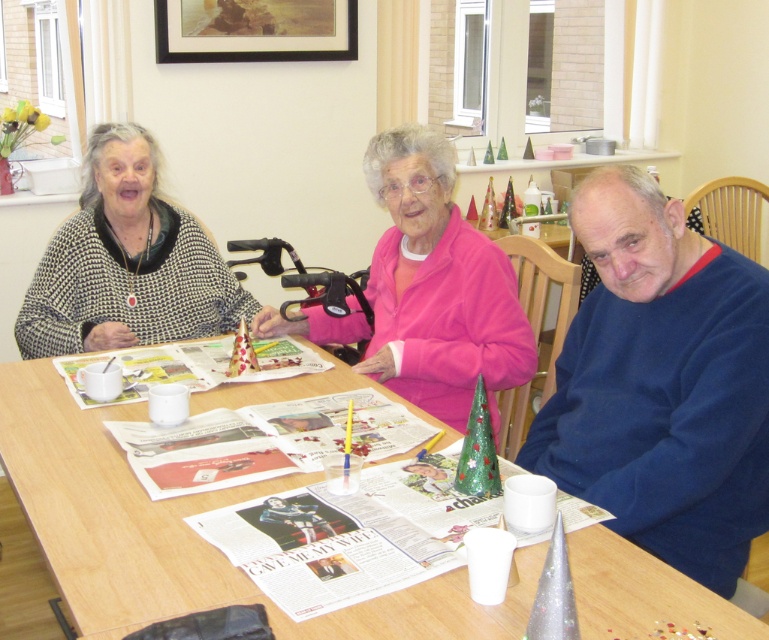
Question: Estimate the real-world distances between objects in this image. Which object is farther from the knitted sweater at left?

Choices:
 (A) wooden table at center
 (B) pink fleece jacket at center

Answer: (B)

Question: Can you confirm if wooden table at center is positioned above pink fleece jacket at center?

Choices:
 (A) no
 (B) yes

Answer: (A)

Question: Estimate the real-world distances between objects in this image. Which object is closer to the pink fleece jacket at center?

Choices:
 (A) blue fleece sweater at right
 (B) knitted sweater at left
 (C) wooden table at center

Answer: (C)

Question: Can you confirm if blue fleece sweater at right is positioned to the right of wooden table at center?

Choices:
 (A) no
 (B) yes

Answer: (B)

Question: Which point is closer to the camera?

Choices:
 (A) (82, 531)
 (B) (403, 355)

Answer: (A)

Question: Is pink fleece jacket at center smaller than knitted sweater at left?

Choices:
 (A) yes
 (B) no

Answer: (B)